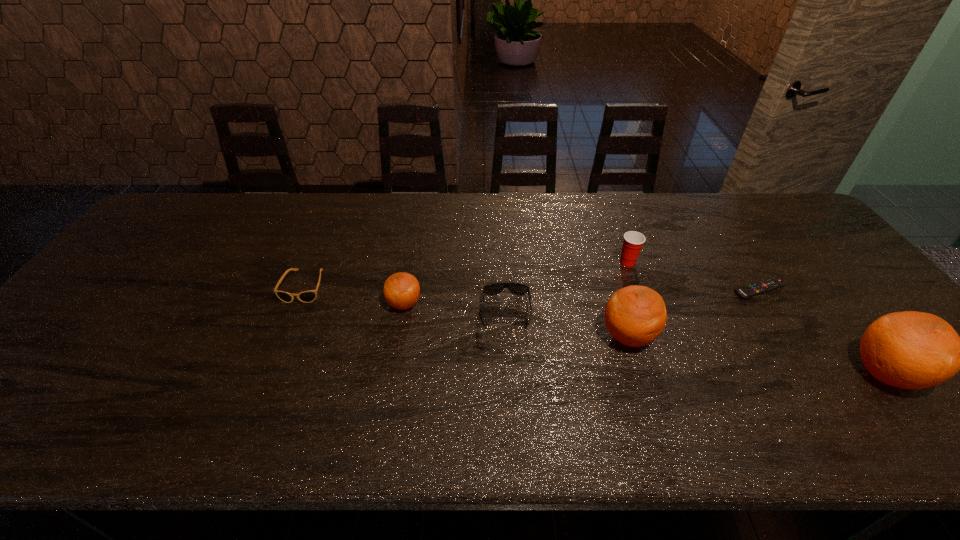
Where is `the second object from left to right`? the second object from left to right is located at coordinates (401, 290).

You are a GUI agent. You are given a task and a screenshot of the screen. Output one action in this format:
    pyautogui.click(x=<x>, y=<y>)
    Task: Click on the shortest orange
    This screenshot has width=960, height=540.
    Given the screenshot: What is the action you would take?
    pyautogui.click(x=401, y=290)

Find the location of a particular element. the second tallest object is located at coordinates (635, 315).

Where is `the second orange from left to right`? This screenshot has height=540, width=960. the second orange from left to right is located at coordinates (635, 315).

You are a GUI agent. You are given a task and a screenshot of the screen. Output one action in this format:
    pyautogui.click(x=<x>, y=<y>)
    Task: Click on the rightmost object
    The height and width of the screenshot is (540, 960).
    Given the screenshot: What is the action you would take?
    pyautogui.click(x=911, y=350)

The height and width of the screenshot is (540, 960). In order to click on Dixie cup in this screenshot , I will do `click(633, 241)`.

Image resolution: width=960 pixels, height=540 pixels. Identify the location of the fifth object from right to left. (520, 289).

The image size is (960, 540). I want to click on remote control, so click(769, 284).

Locate an element on the screen. This screenshot has width=960, height=540. the second object from right to left is located at coordinates (769, 284).

At what (x,y) coordinates should I click in order to perform the action: click on the leftmost object. Please return your answer as a coordinate pair (x, y). This screenshot has height=540, width=960. Looking at the image, I should click on (306, 296).